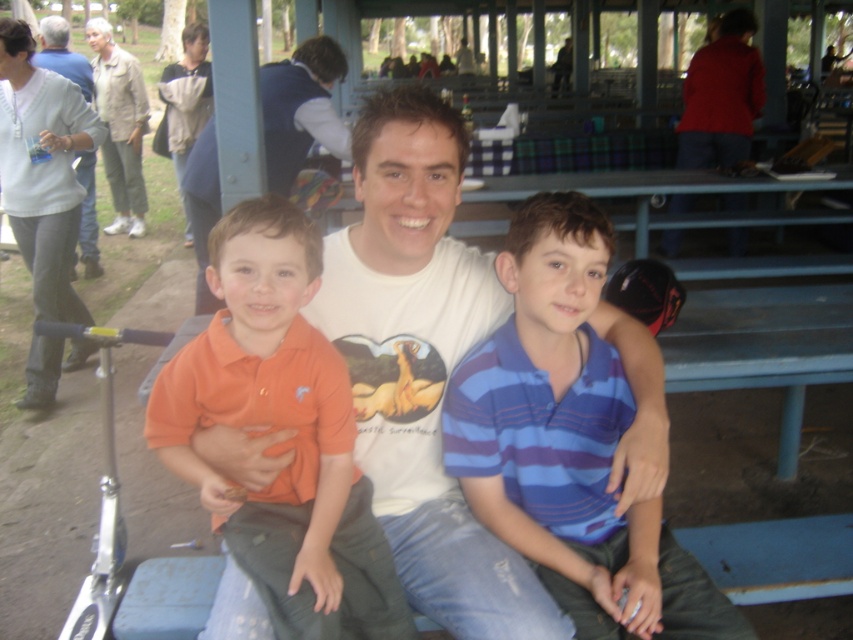
You are a photographer trying to capture a clear photo of the person wearing the beige fabric jacket at upper left and the light gray sweater at upper left. Since both are in the same area, which one might block the other from view?

The light gray sweater at upper left is behind the beige fabric jacket at upper left, so the beige fabric jacket at upper left might block the light gray sweater at upper left from view.

You are a photographer trying to capture a candid shot of the blue striped shirt at center and the beige fabric jacket at upper left. Which subject is closer to the camera?

The blue striped shirt at center is positioned under the beige fabric jacket at upper left, so the beige fabric jacket at upper left is closer to the camera.

You are a photographer trying to capture a candid shot of the blue striped shirt at center and orange cotton shirt at center. Since you want to avoid them noticing the camera, you decide to position yourself behind a tree. Which shirt should you aim your camera towards first to capture both in the frame without moving the camera?

The blue striped shirt at center is located above orange cotton shirt at center, so you should aim your camera towards the blue striped shirt at center first to capture both in the frame without moving the camera.